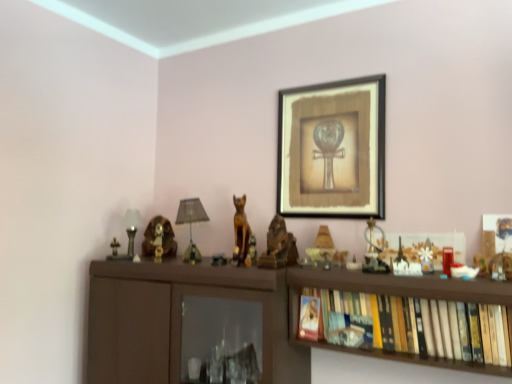
Question: Does metallic gold statue at center, the second toy viewed from the left, have a lesser height compared to wooden statue at center, the first animal when ordered from right to left?

Choices:
 (A) no
 (B) yes

Answer: (B)

Question: Can you confirm if metallic gold statue at center, which is the 4th toy from front to back, is smaller than wooden statue at center, which appears as the 3th animal when viewed from the left?

Choices:
 (A) no
 (B) yes

Answer: (B)

Question: Does metallic gold statue at center, which appears as the second toy when viewed from the back, appear on the right side of wooden statue at center, which appears as the 3th animal when viewed from the left?

Choices:
 (A) no
 (B) yes

Answer: (A)

Question: Is metallic gold statue at center, the second toy viewed from the left, facing away from wooden statue at center, marked as the first animal in a front-to-back arrangement?

Choices:
 (A) yes
 (B) no

Answer: (B)

Question: Can you confirm if metallic gold statue at center, which is the 4th toy from front to back, is taller than wooden statue at center, marked as the first animal in a front-to-back arrangement?

Choices:
 (A) yes
 (B) no

Answer: (B)

Question: Is point (254, 253) closer or farther from the camera than point (138, 225)?

Choices:
 (A) closer
 (B) farther

Answer: (A)

Question: From a real-world perspective, is metallic gold statue at center, which appears as the second toy when viewed from the back, above or below matte silver table lamp at left, which is counted as the 1th table lamp, starting from the left?

Choices:
 (A) above
 (B) below

Answer: (B)

Question: From the image's perspective, is metallic gold statue at center, which ranks as the 4th toy in right-to-left order, positioned above or below matte silver table lamp at left, which appears as the 2th table lamp when viewed from the right?

Choices:
 (A) below
 (B) above

Answer: (A)

Question: Is metallic gold statue at center, which is the 4th toy from front to back, spatially inside matte silver table lamp at left, which is counted as the 1th table lamp, starting from the left, or outside of it?

Choices:
 (A) inside
 (B) outside

Answer: (B)

Question: Looking at their shapes, would you say wooden cat at center, which is counted as the second animal, starting from the left, is wider or thinner than matte brown dog at left, which appears as the third animal when viewed from the right?

Choices:
 (A) thin
 (B) wide

Answer: (A)

Question: Is wooden cat at center, which ranks as the second animal in right-to-left order, inside or outside of matte brown dog at left, which appears as the third animal when viewed from the right?

Choices:
 (A) inside
 (B) outside

Answer: (B)

Question: Looking at the image, does wooden cat at center, which ranks as the second animal in right-to-left order, seem bigger or smaller compared to matte brown dog at left, which appears as the third animal when viewed from the right?

Choices:
 (A) big
 (B) small

Answer: (B)

Question: Is point (234, 223) positioned closer to the camera than point (165, 228)?

Choices:
 (A) farther
 (B) closer

Answer: (A)

Question: From the image's perspective, is matte gold lamp at center-right, which is the 3th toy from left to right, above or below metallic gold statue at center, the second toy viewed from the left?

Choices:
 (A) above
 (B) below

Answer: (A)

Question: Looking at their shapes, would you say matte gold lamp at center-right, which is the 3th toy from left to right, is wider or thinner than metallic gold statue at center, which is the 4th toy from front to back?

Choices:
 (A) wide
 (B) thin

Answer: (A)